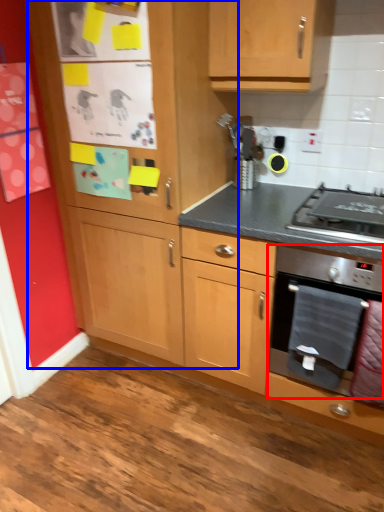
Question: Which object appears closest to the camera in this image, kitchen appliance (highlighted by a red box) or cabinetry (highlighted by a blue box)?

Choices:
 (A) kitchen appliance
 (B) cabinetry

Answer: (B)